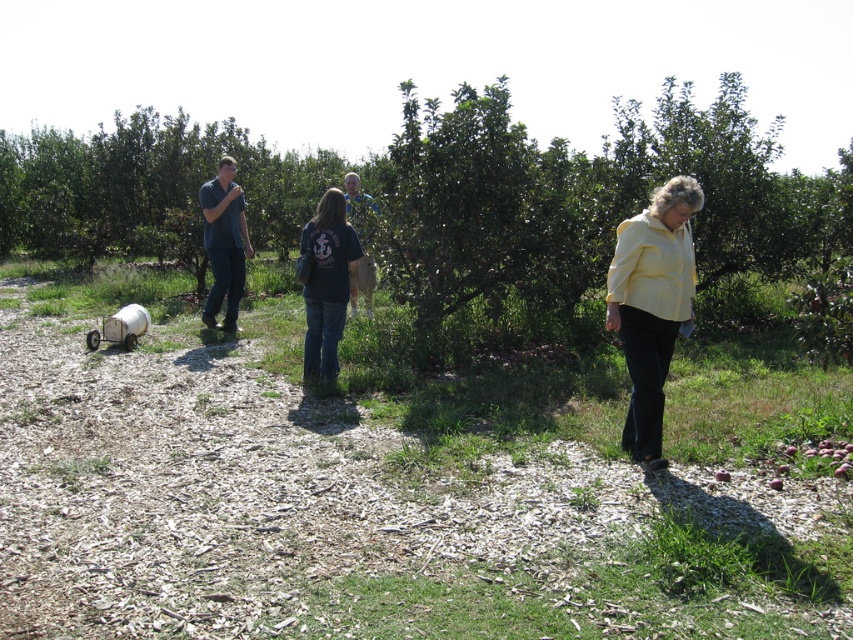
You are a drone operator trying to capture a photo of the yellow matte shirt at center from the camera. The drone has a maximum effective range of 15 feet. Can the drone successfully capture the photo?

The yellow matte shirt at center is 15.86 feet away from the camera, which exceeds the drone operator drone has a maximum effective range of 15 feet. Therefore, the drone cannot successfully capture the photo.

You are a visitor in the orchard and want to take a photo of the blue denim jeans at left without the green leafy tree at center blocking the view. Which direction should you move to ensure the tree is out of the frame?

The green leafy tree at center is closer to the viewer than the blue denim jeans at left. To avoid the tree blocking the view of the blue denim jeans at left, you should move to the left side of the frame where the tree is farther away from the jeans, allowing a clear shot.

You are a visitor in the orchard and want to find the nearest point to your current location. You can see two points marked in the image. Which point is closer to you, point (306, 218) or point (236, 225)?

Point (306, 218) is closer to you because it is further to the camera than point (236, 225).